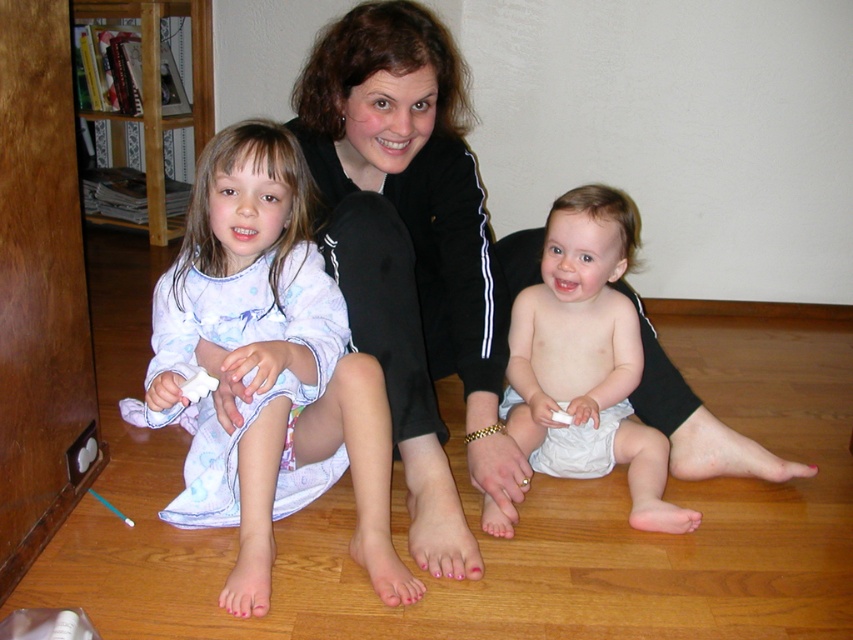
Question: In this image, where is light blue cotton pajamas at left located relative to white cloth diaper at center?

Choices:
 (A) left
 (B) right

Answer: (A)

Question: Is light blue cotton pajamas at left positioned behind white cloth diaper at center?

Choices:
 (A) no
 (B) yes

Answer: (A)

Question: Which object is farther from the camera taking this photo?

Choices:
 (A) light blue cotton pajamas at left
 (B) wooden bookshelf at left
 (C) black smooth tracksuit at center

Answer: (B)

Question: Is black smooth tracksuit at center wider than light blue cotton pajamas at left?

Choices:
 (A) yes
 (B) no

Answer: (A)

Question: Which of the following is the farthest from the observer?

Choices:
 (A) (155, 205)
 (B) (584, 468)

Answer: (A)

Question: Which object is closer to the camera taking this photo?

Choices:
 (A) white diaper at center
 (B) black smooth tracksuit at center
 (C) white cloth diaper at center
 (D) light blue cotton pajamas at left

Answer: (D)